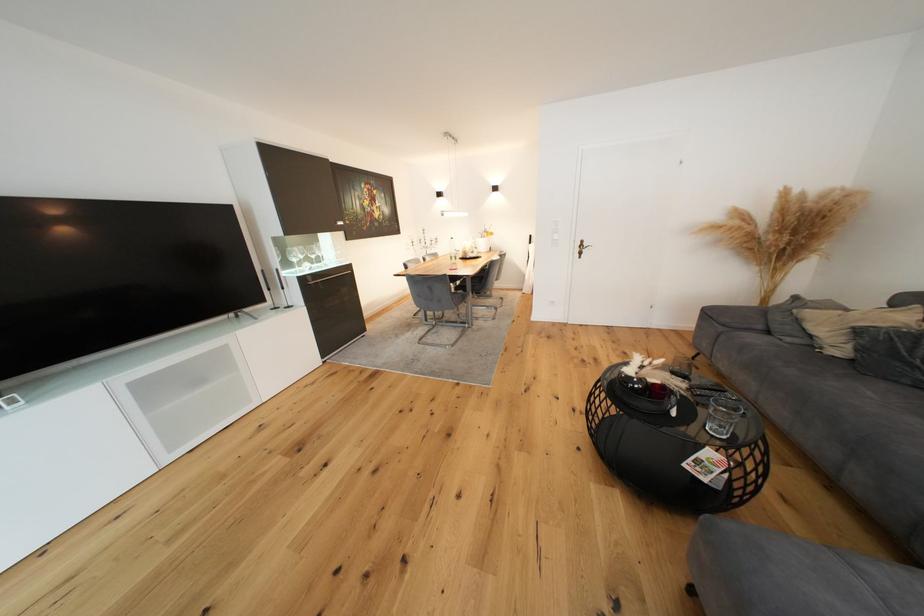
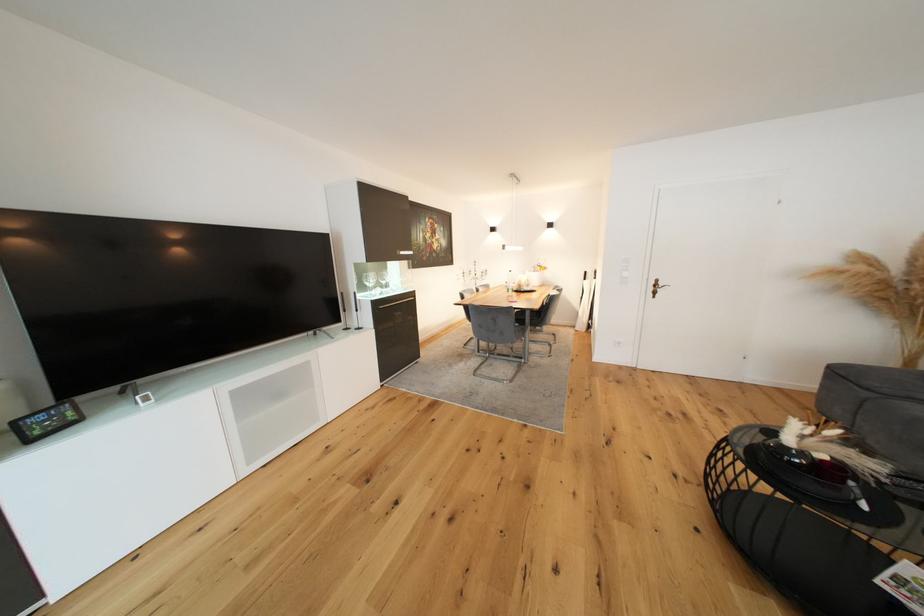
Find the pixel in the second image that matches (295,265) in the first image.

(370, 289)